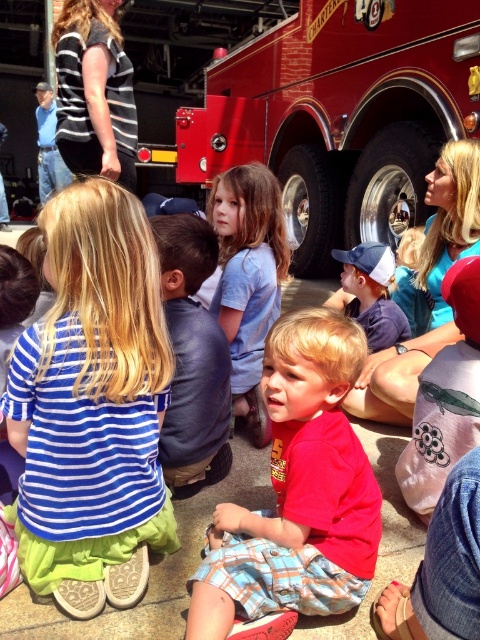
Where is the blue striped shirt at center located in the image?

The blue striped shirt at center is located at point (93, 404) in the image.

You are a photographer trying to capture a clear shot of the blue striped shirt at center and the shiny red fire truck at center. Based on their positions, which one would appear larger in your photo?

The blue striped shirt at center would appear larger in the photo because it is closer to the viewer than the shiny red fire truck at center.

You are a photographer trying to capture a photo of the children in front of the red fire truck. You notice two shirts at the center of the scene. Which shirt is closer to the camera, the blue striped shirt at center or the light blue cotton shirt at center?

The light blue cotton shirt at center is closer to the camera because the blue striped shirt at center is located below it, indicating it is positioned further back.